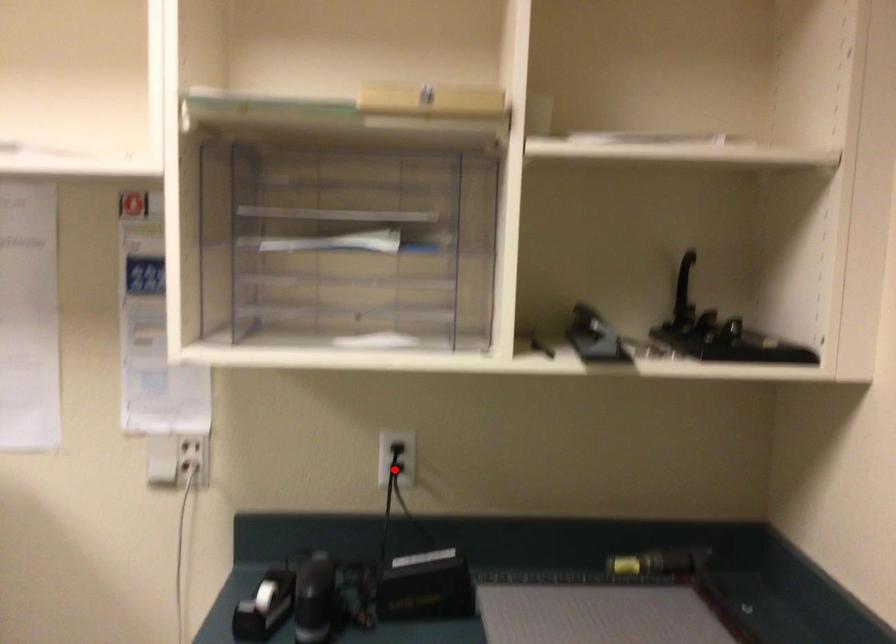
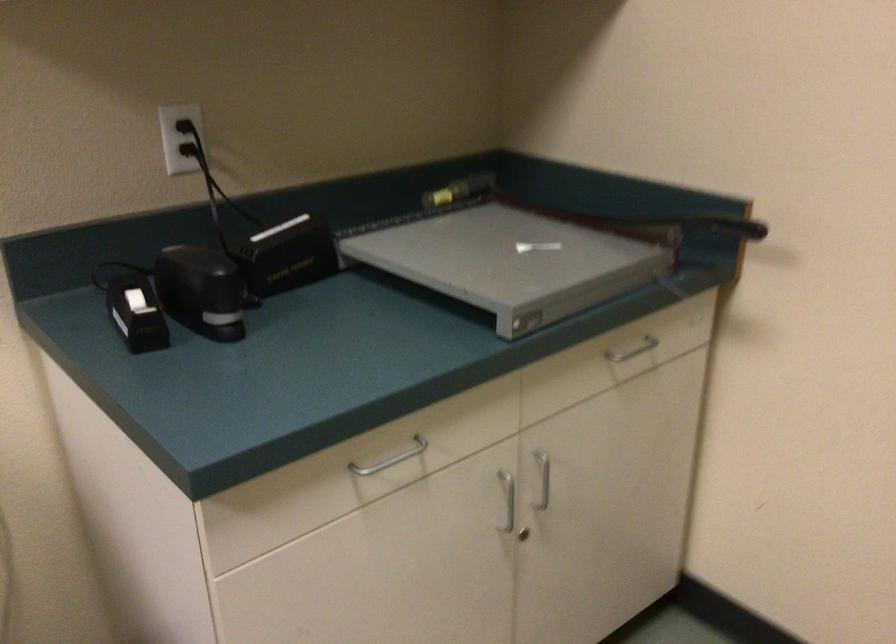
The point at the highlighted location is marked in the first image. Where is the corresponding point in the second image?

(192, 149)